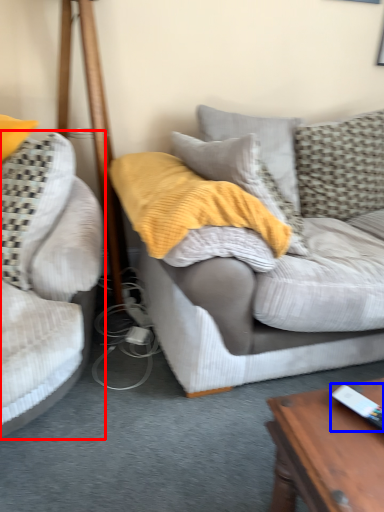
Question: Which of the following is the farthest to the observer, studio couch (highlighted by a red box) or ipod (highlighted by a blue box)?

Choices:
 (A) studio couch
 (B) ipod

Answer: (A)